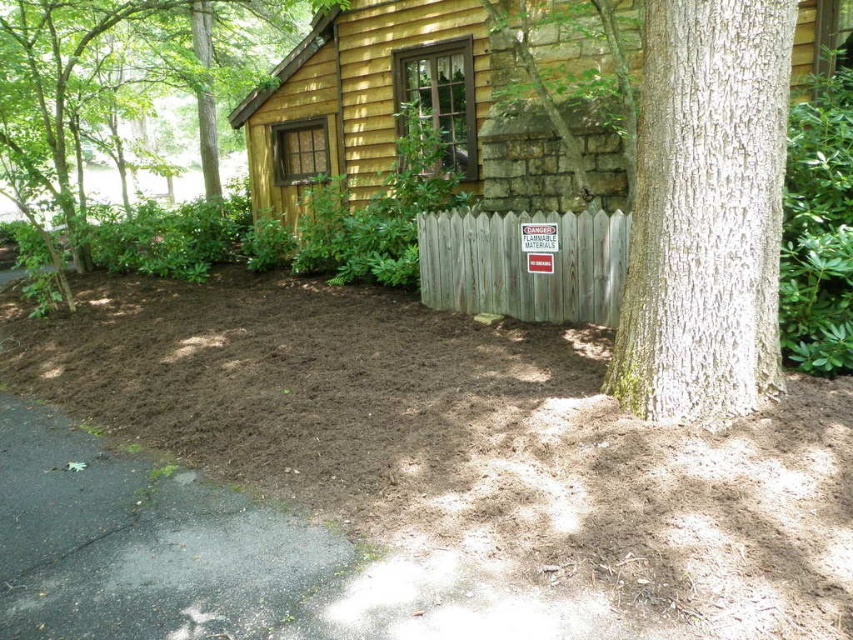
Question: Which object is closer to the camera taking this photo?

Choices:
 (A) white textured bark at center
 (B) weathered wood fence at center

Answer: (A)

Question: Among these points, which one is farthest from the camera?

Choices:
 (A) click(x=50, y=36)
 (B) click(x=608, y=186)

Answer: (A)

Question: Among these points, which one is farthest from the camera?

Choices:
 (A) (120, 83)
 (B) (548, 216)
 (C) (483, 138)
 (D) (737, 378)

Answer: (A)

Question: Is wooden cabin at center positioned before brown textured tree at left?

Choices:
 (A) yes
 (B) no

Answer: (A)

Question: Does wooden cabin at center have a lesser width compared to brown textured tree at left?

Choices:
 (A) no
 (B) yes

Answer: (A)

Question: Does wooden cabin at center appear under weathered wood fence at center?

Choices:
 (A) no
 (B) yes

Answer: (A)